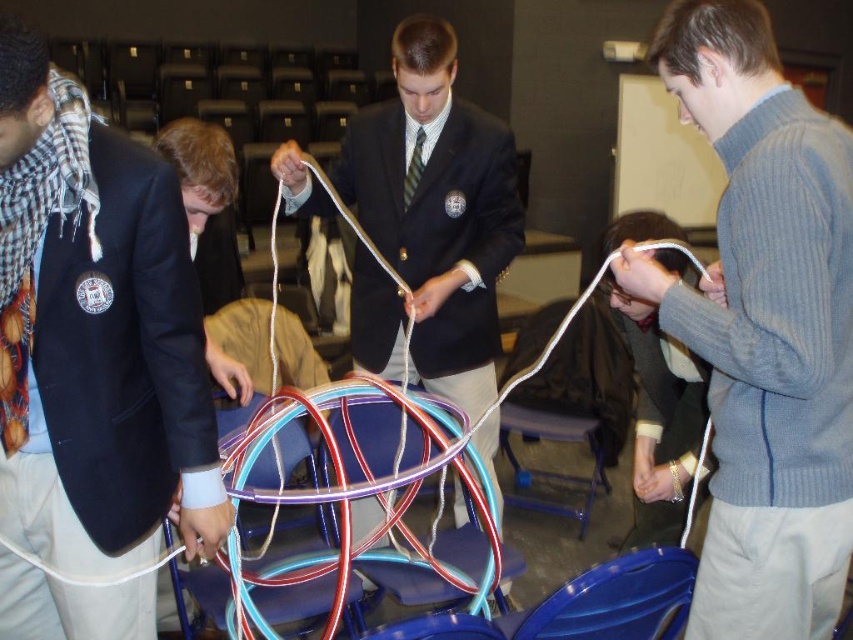
You are an observer in the room. You notice the matte black blazer at left and the gold metallic bracelet at upper center. Which object is closer to you?

The matte black blazer at left is closer to you because it is in front of the gold metallic bracelet at upper center.

You are organizing a craft activity and need to choose between two translucent rubber bands. The translucent rubber band at center and the translucent rubber band at lower center are available. Which one can stretch further without breaking?

The translucent rubber band at lower center can stretch further without breaking because it is larger than the translucent rubber band at center.